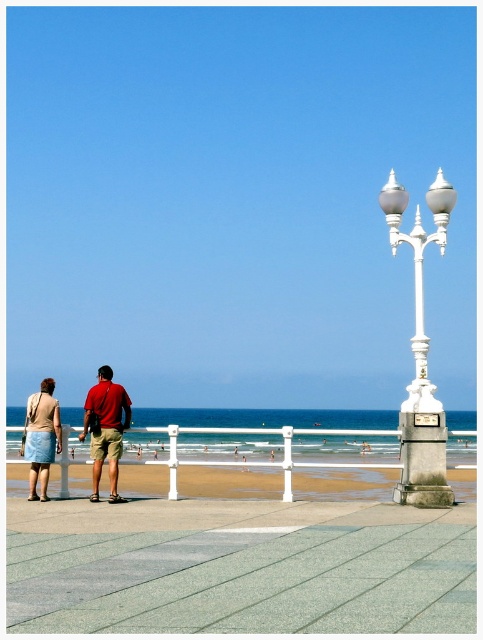
Question: Which object appears farthest from the camera in this image?

Choices:
 (A) denim skirt at lower left
 (B) white polished metal lamp post at right
 (C) red cotton shirt at center
 (D) matte red shirt at center

Answer: (A)

Question: Is red cotton shirt at center positioned behind denim skirt at lower left?

Choices:
 (A) yes
 (B) no

Answer: (B)

Question: Can you confirm if smooth sand beach at center is bigger than white polished metal lamp post at right?

Choices:
 (A) no
 (B) yes

Answer: (B)

Question: Among these objects, which one is farthest from the camera?

Choices:
 (A) matte red shirt at center
 (B) smooth sand beach at center

Answer: (A)

Question: Among these objects, which one is farthest from the camera?

Choices:
 (A) denim skirt at lower left
 (B) white polished metal lamp post at right
 (C) smooth sand beach at center
 (D) matte red shirt at center

Answer: (A)

Question: Does smooth sand beach at center lie in front of red cotton shirt at center?

Choices:
 (A) yes
 (B) no

Answer: (A)